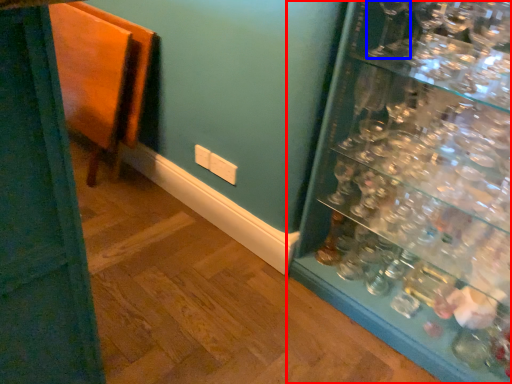
Question: Among these objects, which one is nearest to the camera, shelf (highlighted by a red box) or wine glass (highlighted by a blue box)?

Choices:
 (A) shelf
 (B) wine glass

Answer: (A)